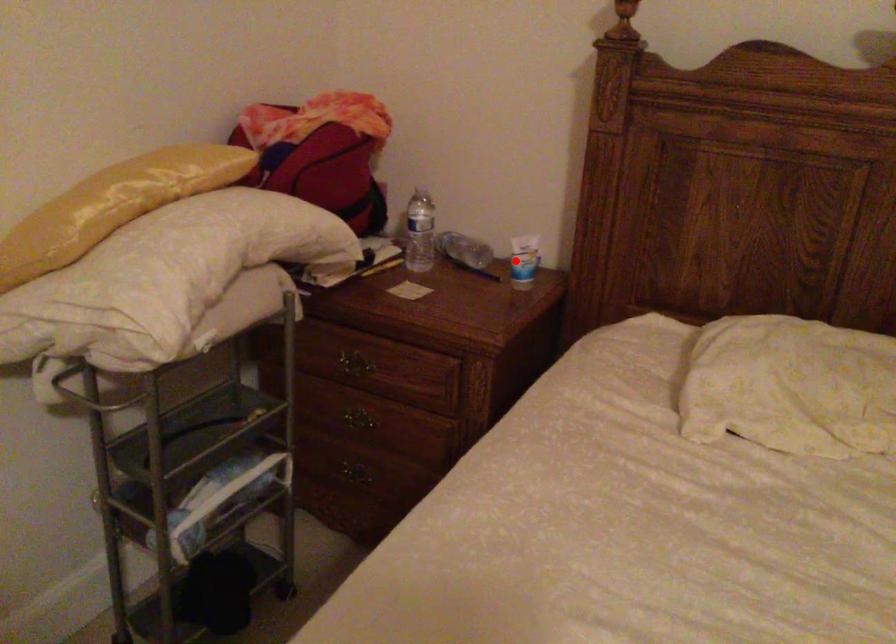
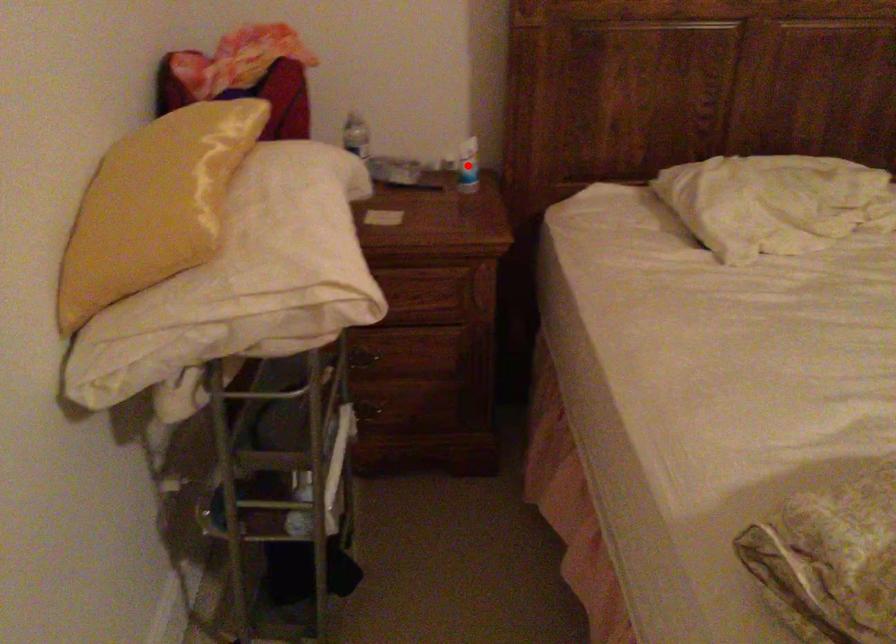
I am providing you with two images of the same scene from different viewpoints. A red point is marked on the first image and another point is marked on the second image. Are the points marked in image1 and image2 representing the same 3D position?

Yes